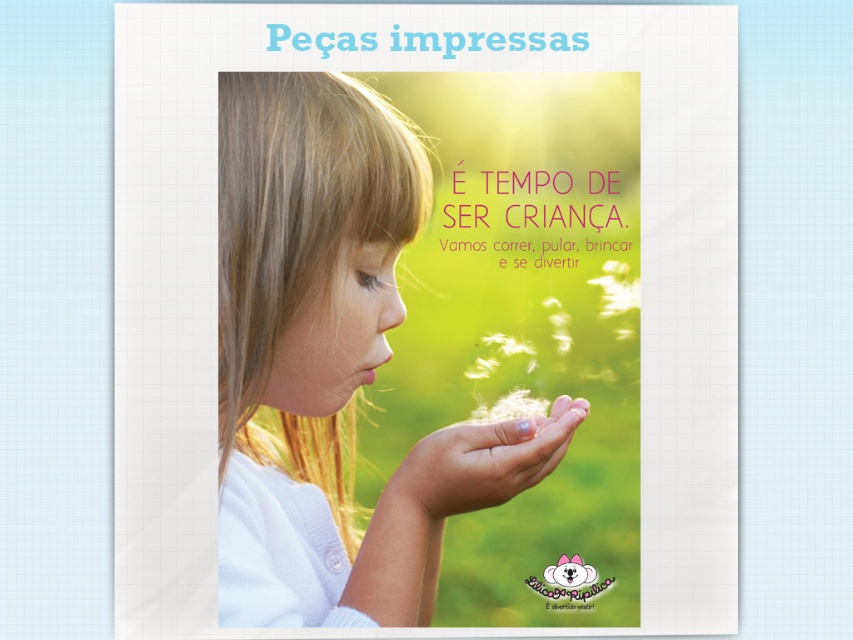
Question: Can you confirm if smooth blonde hair at center is positioned above pale skin/soft hand at center?

Choices:
 (A) yes
 (B) no

Answer: (A)

Question: Which object is closer to the camera taking this photo?

Choices:
 (A) pale skin/soft hand at center
 (B) smooth blonde hair at center

Answer: (B)

Question: Does smooth blonde hair at center come in front of pale skin/soft hand at center?

Choices:
 (A) yes
 (B) no

Answer: (A)

Question: Can you confirm if smooth blonde hair at center is smaller than pale skin/soft hand at center?

Choices:
 (A) no
 (B) yes

Answer: (A)